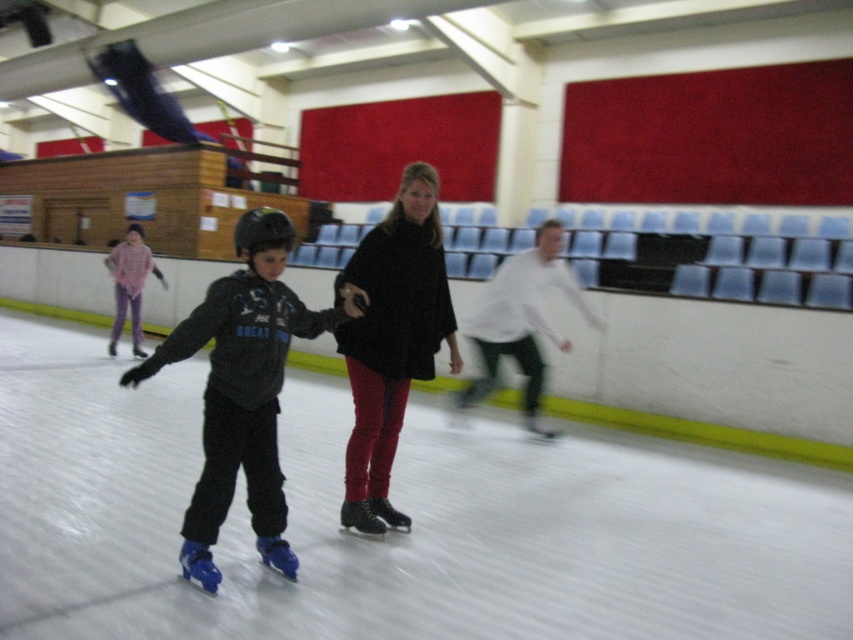
You are standing at the entrance of the ice skating rink and want to find the matte blue roller skates at center. According to the coordinates provided, which direction should you look to locate them?

The matte blue roller skates at center are located at coordinates point (x=242, y=388). Since the x coordinate is 0.609, which is more than 0.5, you should look to the right side of the image. The y coordinate is 0.286, which is below 0.5, so you should look towards the lower part of the image. Combining both, the skates are in the lower right direction from your current position at the entrance.

You are a spectator at the rink and want to know if the matte blue roller skates at center can fit inside the white matte jacket at center. Based on their sizes, what do you think?

The matte blue roller skates at center is thinner than the white matte jacket at center, so they can fit inside.